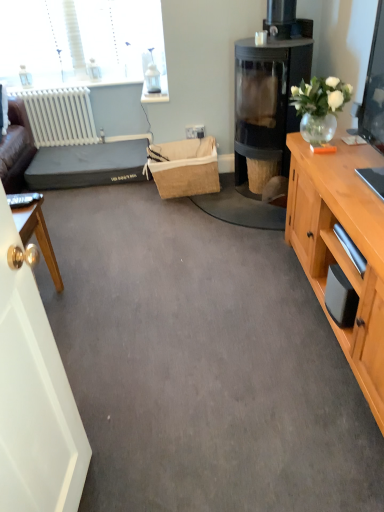
Where is `vacant space behind white glossy door at left`? The height and width of the screenshot is (512, 384). vacant space behind white glossy door at left is located at coordinates (111, 428).